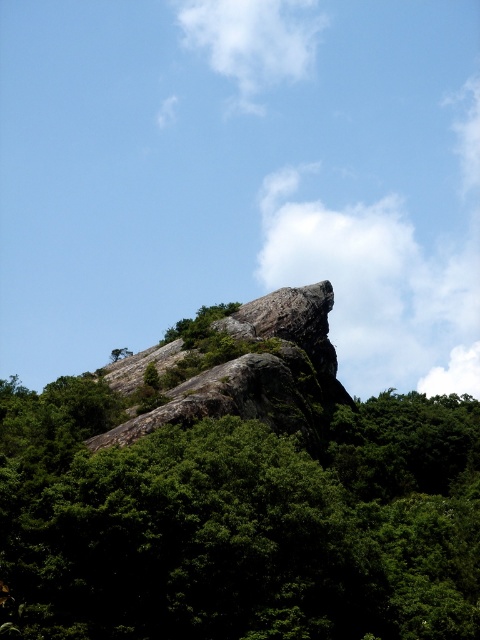
Looking at this image, what are the coordinates of the green leafy tree at center in the image?

The green leafy tree at center is located at coordinates point (239, 522).

Looking at this image, you are planning to set up a picnic area in this landscape. You want to place a picnic blanket between the green leafy tree at center and the rough granite rock at center. Which object should you position closer to ensure the blanket fits comfortably between them?

The green leafy tree at center is wider than the rough granite rock at center. Position the blanket closer to the rough granite rock at center to accommodate the tree.

You are a photographer planning to capture the rough granite rock at center and the white fluffy cloud at upper center in a single frame. Based on their sizes, which object should you focus on to ensure both are clearly visible in the photo?

The rough granite rock at center is bigger than the white fluffy cloud at upper center, so focusing on the rough granite rock at center would allow both to be clearly visible since it occupies more space in the frame.